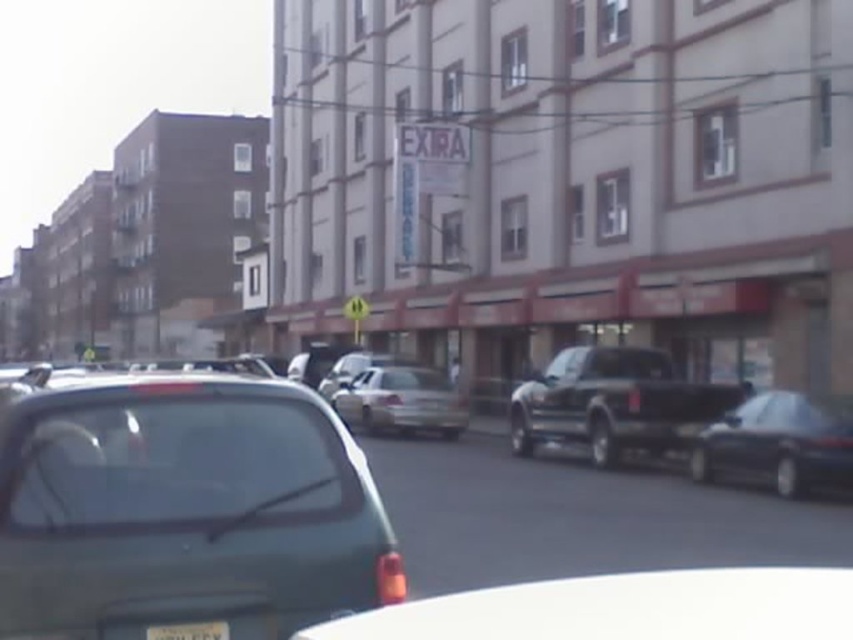
Between shiny black sedan at center and metallic silver sedan at center, which one appears on the left side from the viewer's perspective?

From the viewer's perspective, metallic silver sedan at center appears more on the left side.

Is shiny black sedan at center positioned before metallic silver sedan at center?

Yes, it is in front of metallic silver sedan at center.

Image resolution: width=853 pixels, height=640 pixels. Identify the location of shiny black sedan at center. (779, 442).

Which is below, shiny black sedan at center or silver metallic sedan at center?

Positioned lower is silver metallic sedan at center.

You are a GUI agent. You are given a task and a screenshot of the screen. Output one action in this format:
    pyautogui.click(x=<x>, y=<y>)
    Task: Click on the shiny black sedan at center
    
    Given the screenshot: What is the action you would take?
    pyautogui.click(x=779, y=442)

Does black matte truck at center lie in front of shiny black sedan at center?

No, it is behind shiny black sedan at center.

Is point (656, 436) farther from viewer compared to point (727, 445)?

Yes, it is.

Measure the distance between point [691,406] and camera.

The distance of point [691,406] from camera is 16.08 meters.

Image resolution: width=853 pixels, height=640 pixels. Find the location of `black matte truck at center`. black matte truck at center is located at coordinates (614, 403).